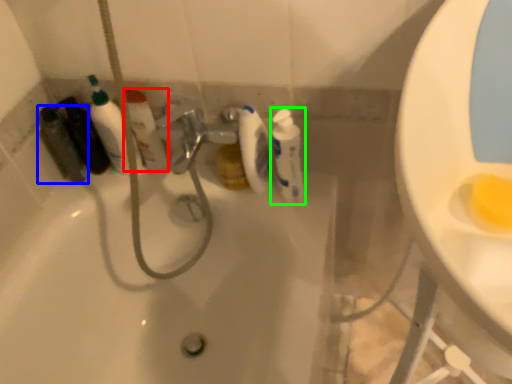
Question: Estimate the real-world distances between objects in this image. Which object is farther from cleaning product (highlighted by a red box), mouthwash (highlighted by a blue box) or cleaning product (highlighted by a green box)?

Choices:
 (A) mouthwash
 (B) cleaning product

Answer: (B)